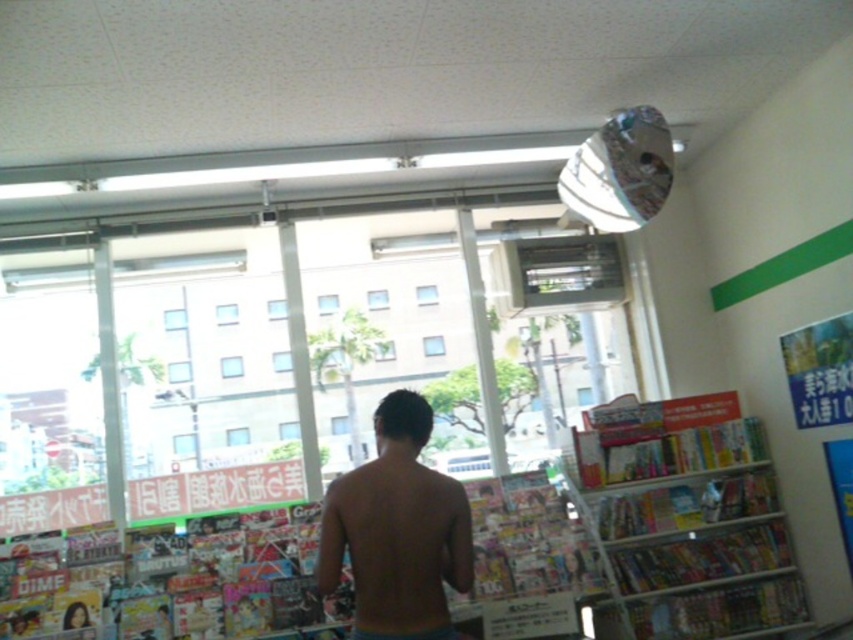
Image resolution: width=853 pixels, height=640 pixels. What do you see at coordinates (685, 516) in the screenshot?
I see `multicolored paperbacks at right` at bounding box center [685, 516].

Which is below, multicolored paperbacks at right or nude skin at center?

multicolored paperbacks at right

Does point (753, 522) come closer to viewer compared to point (428, 611)?

No.

What are the coordinates of `multicolored paperbacks at right` in the screenshot? It's located at (685, 516).